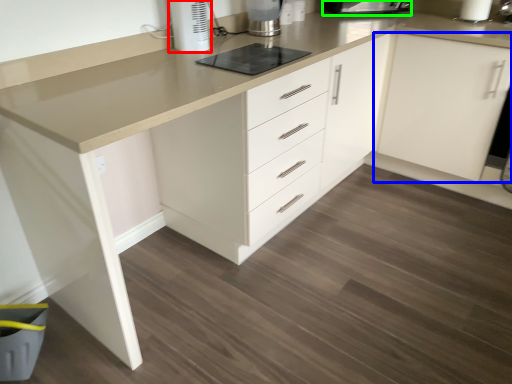
Question: Based on their relative distances, which object is nearer to home appliance (highlighted by a red box)? Choose from cabinetry (highlighted by a blue box) and kitchen appliance (highlighted by a green box).

Choices:
 (A) cabinetry
 (B) kitchen appliance

Answer: (B)